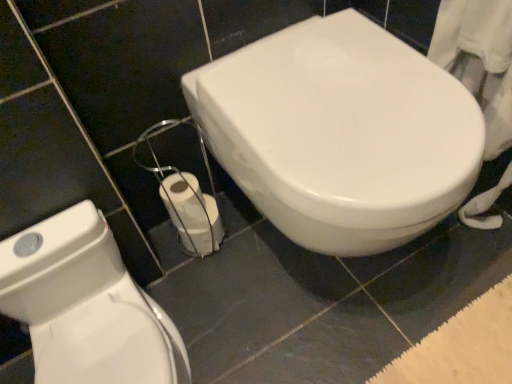
What do you see at coordinates (86, 306) in the screenshot? The image size is (512, 384). I see `white glossy toilet at lower left, the 2th toilet when ordered from right to left` at bounding box center [86, 306].

The image size is (512, 384). In order to click on white matte toilet paper at lower center in this screenshot , I will do point(192,213).

This screenshot has height=384, width=512. I want to click on white glossy toilet at lower left, acting as the 1th toilet starting from the left, so click(x=86, y=306).

From the image's perspective, is white matte toilet paper at lower center on white glossy toilet at lower left, acting as the 1th toilet starting from the left?

Yes.

Is white matte toilet paper at lower center positioned far away from white glossy toilet at lower left, acting as the 1th toilet starting from the left?

Actually, white matte toilet paper at lower center and white glossy toilet at lower left, acting as the 1th toilet starting from the left, are a little close together.

Is white matte toilet paper at lower center smaller than white glossy toilet at lower left, the 2th toilet when ordered from right to left?

Yes, white matte toilet paper at lower center is smaller than white glossy toilet at lower left, the 2th toilet when ordered from right to left.

Is white matte toilet paper at lower center facing away from white glossy toilet at lower left, acting as the 1th toilet starting from the left?

No, white glossy toilet at lower left, acting as the 1th toilet starting from the left, is not at the back of white matte toilet paper at lower center.

Would you say white glossy toilet at center, the 2th toilet from the left, is a long distance from white glossy toilet at lower left, the 2th toilet when ordered from right to left?

white glossy toilet at center, the 2th toilet from the left, is actually quite close to white glossy toilet at lower left, the 2th toilet when ordered from right to left.

Does white glossy toilet at center, the 2th toilet from the left, have a smaller size compared to white glossy toilet at lower left, the 2th toilet when ordered from right to left?

Actually, white glossy toilet at center, the 2th toilet from the left, might be larger than white glossy toilet at lower left, the 2th toilet when ordered from right to left.

From the image's perspective, who appears lower, white glossy toilet at center, acting as the 1th toilet starting from the right, or white glossy toilet at lower left, the 2th toilet when ordered from right to left?

white glossy toilet at lower left, the 2th toilet when ordered from right to left.

Does white glossy toilet at center, acting as the 1th toilet starting from the right, turn towards white glossy toilet at lower left, the 2th toilet when ordered from right to left?

No, white glossy toilet at center, acting as the 1th toilet starting from the right, is not oriented towards white glossy toilet at lower left, the 2th toilet when ordered from right to left.

At what (x,y) coordinates should I click in order to perform the action: click on the 1st toilet in front when counting from the white matte toilet paper at lower center. Please return your answer as a coordinate pair (x, y). Looking at the image, I should click on (340, 133).

Considering the relative sizes of white glossy toilet at center, acting as the 1th toilet starting from the right, and white matte toilet paper at lower center in the image provided, is white glossy toilet at center, acting as the 1th toilet starting from the right, thinner than white matte toilet paper at lower center?

Incorrect, the width of white glossy toilet at center, acting as the 1th toilet starting from the right, is not less than that of white matte toilet paper at lower center.

Can you tell me how much white glossy toilet at center, acting as the 1th toilet starting from the right, and white matte toilet paper at lower center differ in facing direction?

white glossy toilet at center, acting as the 1th toilet starting from the right, and white matte toilet paper at lower center are facing 5.95 degrees away from each other.

Which point is more forward, (382, 204) or (214, 204)?

The point (382, 204) is closer.

Identify the location of toilet that is on the right side of white glossy toilet at lower left, acting as the 1th toilet starting from the left. The width and height of the screenshot is (512, 384). (340, 133).

Looking at this image, does white glossy toilet at lower left, the 2th toilet when ordered from right to left, turn towards white glossy toilet at center, acting as the 1th toilet starting from the right?

No, white glossy toilet at lower left, the 2th toilet when ordered from right to left, is not oriented towards white glossy toilet at center, acting as the 1th toilet starting from the right.

Which is more to the right, white glossy toilet at lower left, acting as the 1th toilet starting from the left, or white glossy toilet at center, acting as the 1th toilet starting from the right?

Positioned to the right is white glossy toilet at center, acting as the 1th toilet starting from the right.

Would you say white glossy toilet at lower left, the 2th toilet when ordered from right to left, contains white glossy toilet at center, the 2th toilet from the left?

Definitely not — white glossy toilet at center, the 2th toilet from the left, is not inside white glossy toilet at lower left, the 2th toilet when ordered from right to left.

Could you measure the distance between white matte toilet paper at lower center and white glossy toilet at center, acting as the 1th toilet starting from the right?

They are 14.27 inches apart.

Considering the sizes of white matte toilet paper at lower center and white glossy toilet at center, acting as the 1th toilet starting from the right, in the image, is white matte toilet paper at lower center bigger or smaller than white glossy toilet at center, acting as the 1th toilet starting from the right,?

Considering their sizes, white matte toilet paper at lower center takes up less space than white glossy toilet at center, acting as the 1th toilet starting from the right.

Is white matte toilet paper at lower center in contact with white glossy toilet at center, acting as the 1th toilet starting from the right?

white matte toilet paper at lower center and white glossy toilet at center, acting as the 1th toilet starting from the right, are not in contact.

From the image's perspective, is white matte toilet paper at lower center positioned above or below white glossy toilet at center, acting as the 1th toilet starting from the right?

white matte toilet paper at lower center is situated lower than white glossy toilet at center, acting as the 1th toilet starting from the right, in the image.

Is white glossy toilet at lower left, acting as the 1th toilet starting from the left, spatially inside white matte toilet paper at lower center, or outside of it?

white glossy toilet at lower left, acting as the 1th toilet starting from the left, is outside white matte toilet paper at lower center.

What's the angular difference between white glossy toilet at lower left, acting as the 1th toilet starting from the left, and white matte toilet paper at lower center's facing directions?

4.37 degrees.

From a real-world perspective, is white glossy toilet at lower left, the 2th toilet when ordered from right to left, physically located above or below white matte toilet paper at lower center?

white glossy toilet at lower left, the 2th toilet when ordered from right to left, is above white matte toilet paper at lower center.

Considering the relative positions of white glossy toilet at lower left, the 2th toilet when ordered from right to left, and white matte toilet paper at lower center in the image provided, is white glossy toilet at lower left, the 2th toilet when ordered from right to left, behind white matte toilet paper at lower center?

No.

This screenshot has width=512, height=384. Find the location of `toilet that appears below the white matte toilet paper at lower center (from the image's perspective)`. toilet that appears below the white matte toilet paper at lower center (from the image's perspective) is located at coordinates (86, 306).

Identify the location of toilet behind the white glossy toilet at lower left, acting as the 1th toilet starting from the left. (340, 133).

Consider the image. Looking at the image, which one is located closer to white matte toilet paper at lower center, white glossy toilet at center, acting as the 1th toilet starting from the right, or white glossy toilet at lower left, the 2th toilet when ordered from right to left?

white glossy toilet at lower left, the 2th toilet when ordered from right to left, is positioned closer to the anchor white matte toilet paper at lower center.

Consider the image. Based on their spatial positions, is white glossy toilet at center, the 2th toilet from the left, or white matte toilet paper at lower center closer to white glossy toilet at lower left, acting as the 1th toilet starting from the left?

white matte toilet paper at lower center lies closer to white glossy toilet at lower left, acting as the 1th toilet starting from the left, than the other object.

Considering their positions, is white glossy toilet at lower left, the 2th toilet when ordered from right to left, positioned closer to white glossy toilet at center, acting as the 1th toilet starting from the right, than white matte toilet paper at lower center?

white matte toilet paper at lower center is positioned closer to the anchor white glossy toilet at center, acting as the 1th toilet starting from the right.

Looking at this image, based on their spatial positions, is white matte toilet paper at lower center or white glossy toilet at lower left, the 2th toilet when ordered from right to left, closer to white glossy toilet at center, acting as the 1th toilet starting from the right?

white matte toilet paper at lower center lies closer to white glossy toilet at center, acting as the 1th toilet starting from the right, than the other object.

Looking at the image, which one is located closer to white glossy toilet at lower left, the 2th toilet when ordered from right to left, white matte toilet paper at lower center or white glossy toilet at center, acting as the 1th toilet starting from the right?

white matte toilet paper at lower center.

Considering their positions, is white glossy toilet at lower left, acting as the 1th toilet starting from the left, positioned further to white matte toilet paper at lower center than white glossy toilet at center, the 2th toilet from the left?

white glossy toilet at center, the 2th toilet from the left, lies further to white matte toilet paper at lower center than the other object.

You are a GUI agent. You are given a task and a screenshot of the screen. Output one action in this format:
    pyautogui.click(x=<x>, y=<y>)
    Task: Click on the toilet between white glossy toilet at lower left, acting as the 1th toilet starting from the left, and white matte toilet paper at lower center, along the z-axis
    The width and height of the screenshot is (512, 384).
    Given the screenshot: What is the action you would take?
    pyautogui.click(x=340, y=133)